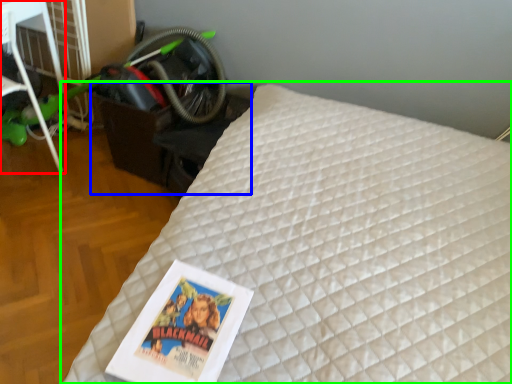
Question: Estimate the real-world distances between objects in this image. Which object is closer to furniture (highlighted by a red box), table (highlighted by a blue box) or bed (highlighted by a green box)?

Choices:
 (A) table
 (B) bed

Answer: (A)